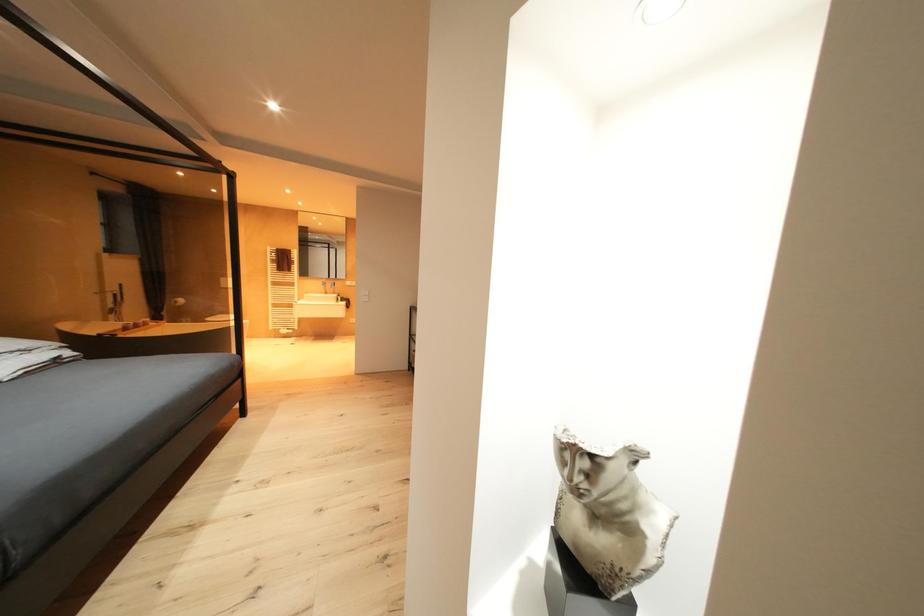
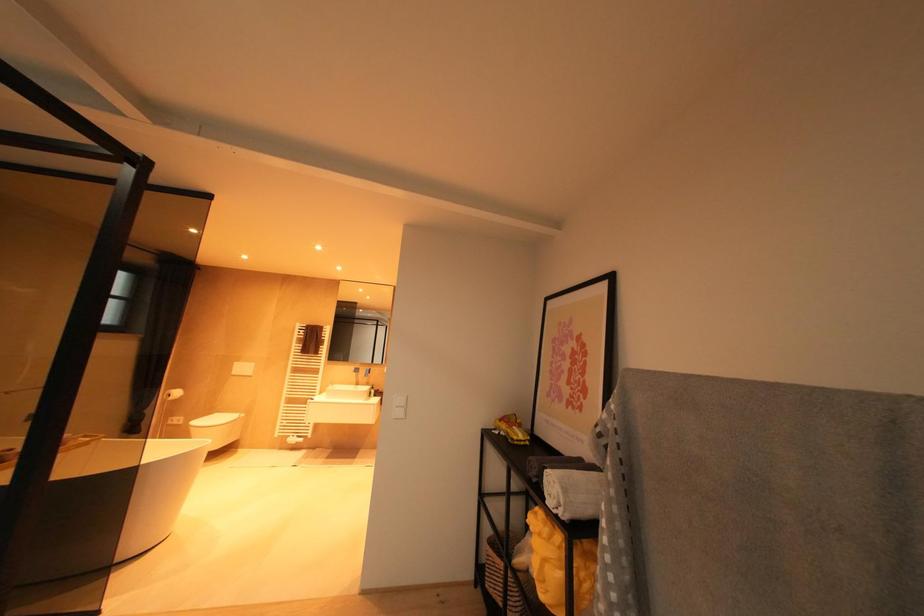
Question: In a continuous first-person perspective shot, in which direction is the camera moving?

Choices:
 (A) Left
 (B) Right
 (C) Forward
 (D) Backward

Answer: (C)